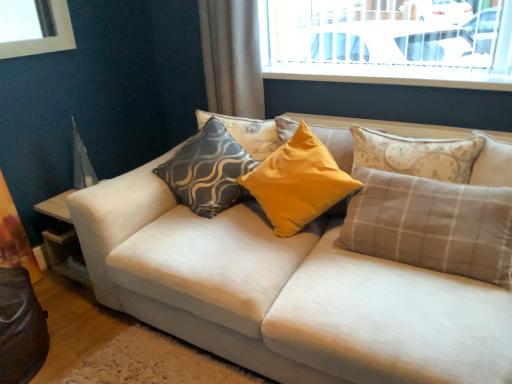
The height and width of the screenshot is (384, 512). I want to click on yellow fabric pillow at center, which is the third pillow from right to left, so click(298, 183).

This screenshot has width=512, height=384. What do you see at coordinates (208, 170) in the screenshot?
I see `matte gray-patterned pillow at center, acting as the 1th pillow starting from the left` at bounding box center [208, 170].

Measure the distance between point (11, 237) and camera.

The depth of point (11, 237) is 7.60 feet.

In order to click on gray plaid pillow at right, which is counted as the 5th pillow, starting from the left in this screenshot , I will do `click(492, 163)`.

The height and width of the screenshot is (384, 512). What do you see at coordinates (285, 293) in the screenshot?
I see `white fabric couch at center` at bounding box center [285, 293].

Image resolution: width=512 pixels, height=384 pixels. In order to click on plaid fabric pillow at center, marked as the 2th pillow in a right-to-left arrangement in this screenshot , I will do `click(432, 225)`.

This screenshot has width=512, height=384. Find the location of `matte gray-patterned pillow at center, arranged as the 4th pillow when viewed from the right`. matte gray-patterned pillow at center, arranged as the 4th pillow when viewed from the right is located at coordinates (247, 133).

Find the location of a particular element. yellow fabric pillow at center, which is the third pillow from left to right is located at coordinates (298, 183).

From the image's perspective, is brown fabric curtain at upper center, acting as the 2th curtain starting from the left, positioned above or below yellow fabric pillow at center, which is the third pillow from left to right?

brown fabric curtain at upper center, acting as the 2th curtain starting from the left, is situated higher than yellow fabric pillow at center, which is the third pillow from left to right, in the image.

Are brown fabric curtain at upper center, which is the first curtain in top-to-bottom order, and yellow fabric pillow at center, which is the third pillow from right to left, far apart?

They are positioned close to each other.

Is plaid fabric pillow at center, marked as the 2th pillow in a right-to-left arrangement, to the right of yellow fabric curtain at left, marked as the 2th curtain in a top-to-bottom arrangement, from the viewer's perspective?

Correct, you'll find plaid fabric pillow at center, marked as the 2th pillow in a right-to-left arrangement, to the right of yellow fabric curtain at left, marked as the 2th curtain in a top-to-bottom arrangement.

From the image's perspective, who appears lower, plaid fabric pillow at center, marked as the 2th pillow in a right-to-left arrangement, or yellow fabric curtain at left, which ranks as the first curtain in left-to-right order?

yellow fabric curtain at left, which ranks as the first curtain in left-to-right order, appears lower in the image.

Which of these two, plaid fabric pillow at center, marked as the 2th pillow in a right-to-left arrangement, or yellow fabric curtain at left, marked as the 2th curtain in a top-to-bottom arrangement, is thinner?

Thinner between the two is yellow fabric curtain at left, marked as the 2th curtain in a top-to-bottom arrangement.

From a real-world perspective, which is physically below, plaid fabric pillow at center, marked as the 2th pillow in a right-to-left arrangement, or yellow fabric curtain at left, the second curtain when ordered from right to left?

yellow fabric curtain at left, the second curtain when ordered from right to left, from a real-world perspective.

Is plaid fabric pillow at center, marked as the 2th pillow in a right-to-left arrangement, shorter than yellow fabric pillow at center, which is the third pillow from left to right?

No, plaid fabric pillow at center, marked as the 2th pillow in a right-to-left arrangement, is not shorter than yellow fabric pillow at center, which is the third pillow from left to right.

From a real-world perspective, between plaid fabric pillow at center, which is the 4th pillow in left-to-right order, and yellow fabric pillow at center, which is the third pillow from left to right, who is vertically higher?

From a 3D spatial view, yellow fabric pillow at center, which is the third pillow from left to right, is above.

Would you say yellow fabric pillow at center, which is the third pillow from left to right, is part of plaid fabric pillow at center, marked as the 2th pillow in a right-to-left arrangement,'s contents?

No, yellow fabric pillow at center, which is the third pillow from left to right, is located outside of plaid fabric pillow at center, marked as the 2th pillow in a right-to-left arrangement.

Is plaid fabric pillow at center, marked as the 2th pillow in a right-to-left arrangement, with yellow fabric pillow at center, which is the third pillow from right to left?

No, plaid fabric pillow at center, marked as the 2th pillow in a right-to-left arrangement, is not in contact with yellow fabric pillow at center, which is the third pillow from right to left.

Can you confirm if yellow fabric curtain at left, marked as the 2th curtain in a top-to-bottom arrangement, is bigger than plaid fabric pillow at center, marked as the 2th pillow in a right-to-left arrangement?

No, yellow fabric curtain at left, marked as the 2th curtain in a top-to-bottom arrangement, is not bigger than plaid fabric pillow at center, marked as the 2th pillow in a right-to-left arrangement.

Which object is thinner, yellow fabric curtain at left, which ranks as the first curtain in left-to-right order, or plaid fabric pillow at center, which is the 4th pillow in left-to-right order?

Thinner between the two is yellow fabric curtain at left, which ranks as the first curtain in left-to-right order.

From the image's perspective, is yellow fabric curtain at left, the 1th curtain in the bottom-to-top sequence, above or below plaid fabric pillow at center, marked as the 2th pillow in a right-to-left arrangement?

Based on their image positions, yellow fabric curtain at left, the 1th curtain in the bottom-to-top sequence, is located beneath plaid fabric pillow at center, marked as the 2th pillow in a right-to-left arrangement.

Is yellow fabric curtain at left, the 1th curtain in the bottom-to-top sequence, closer to camera compared to plaid fabric pillow at center, marked as the 2th pillow in a right-to-left arrangement?

No, yellow fabric curtain at left, the 1th curtain in the bottom-to-top sequence, is further to the viewer.

Is matte gray-patterned pillow at center, which is the 2th pillow from left to right, turned away from yellow fabric curtain at left, the 1th curtain in the bottom-to-top sequence?

No, matte gray-patterned pillow at center, which is the 2th pillow from left to right,'s orientation is not away from yellow fabric curtain at left, the 1th curtain in the bottom-to-top sequence.

In terms of height, does matte gray-patterned pillow at center, which is the 2th pillow from left to right, look taller or shorter compared to yellow fabric curtain at left, which ranks as the first curtain in left-to-right order?

Considering their sizes, matte gray-patterned pillow at center, which is the 2th pillow from left to right, has less height than yellow fabric curtain at left, which ranks as the first curtain in left-to-right order.

Where is `the 2nd pillow to the right of the yellow fabric curtain at left, the 1th curtain in the bottom-to-top sequence, counting from the anchor's position`? The width and height of the screenshot is (512, 384). the 2nd pillow to the right of the yellow fabric curtain at left, the 1th curtain in the bottom-to-top sequence, counting from the anchor's position is located at coordinates (247, 133).

Does plaid fabric pillow at center, marked as the 2th pillow in a right-to-left arrangement, turn towards matte gray-patterned pillow at center, the fifth pillow when ordered from right to left?

No, plaid fabric pillow at center, marked as the 2th pillow in a right-to-left arrangement, is not turned towards matte gray-patterned pillow at center, the fifth pillow when ordered from right to left.

From a real-world perspective, who is located lower, plaid fabric pillow at center, marked as the 2th pillow in a right-to-left arrangement, or matte gray-patterned pillow at center, acting as the 1th pillow starting from the left?

plaid fabric pillow at center, marked as the 2th pillow in a right-to-left arrangement, from a real-world perspective.

Which is correct: plaid fabric pillow at center, marked as the 2th pillow in a right-to-left arrangement, is inside matte gray-patterned pillow at center, acting as the 1th pillow starting from the left, or outside of it?

plaid fabric pillow at center, marked as the 2th pillow in a right-to-left arrangement, cannot be found inside matte gray-patterned pillow at center, acting as the 1th pillow starting from the left.

Is point (233, 33) closer or farther from the camera than point (406, 223)?

Point (233, 33) is farther from the camera than point (406, 223).

Is there a large distance between brown fabric curtain at upper center, acting as the 1th curtain starting from the right, and plaid fabric pillow at center, marked as the 2th pillow in a right-to-left arrangement?

brown fabric curtain at upper center, acting as the 1th curtain starting from the right, is positioned a significant distance from plaid fabric pillow at center, marked as the 2th pillow in a right-to-left arrangement.

Where is `the 2nd curtain behind the plaid fabric pillow at center, marked as the 2th pillow in a right-to-left arrangement, counting from the anchor's position`? This screenshot has width=512, height=384. the 2nd curtain behind the plaid fabric pillow at center, marked as the 2th pillow in a right-to-left arrangement, counting from the anchor's position is located at coordinates (232, 57).

From a real-world perspective, relative to plaid fabric pillow at center, which is the 4th pillow in left-to-right order, is brown fabric curtain at upper center, placed as the second curtain when sorted from bottom to top, vertically above or below?

From a real-world perspective, brown fabric curtain at upper center, placed as the second curtain when sorted from bottom to top, is physically above plaid fabric pillow at center, which is the 4th pillow in left-to-right order.

I want to click on the 2nd pillow positioned below the brown fabric curtain at upper center, acting as the 1th curtain starting from the right (from the image's perspective), so click(x=298, y=183).

From a real-world perspective, count 1st pillows upward from the yellow fabric curtain at left, which ranks as the first curtain in left-to-right order, and point to it. Please provide its 2D coordinates.

[(432, 225)]

Estimate the real-world distances between objects in this image. Which object is further from plaid fabric pillow at center, which is the 4th pillow in left-to-right order, gray plaid pillow at right, which is counted as the 5th pillow, starting from the left, or yellow fabric pillow at center, which is the third pillow from left to right?

yellow fabric pillow at center, which is the third pillow from left to right, is positioned further to the anchor plaid fabric pillow at center, which is the 4th pillow in left-to-right order.

Consider the image. Looking at the image, which one is located closer to brown fabric curtain at upper center, placed as the second curtain when sorted from bottom to top, matte gray-patterned pillow at center, the fifth pillow when ordered from right to left, or plaid fabric pillow at center, marked as the 2th pillow in a right-to-left arrangement?

matte gray-patterned pillow at center, the fifth pillow when ordered from right to left, is closer to brown fabric curtain at upper center, placed as the second curtain when sorted from bottom to top.

From the image, which object appears to be nearer to white fabric couch at center, yellow fabric curtain at left, marked as the 2th curtain in a top-to-bottom arrangement, or matte gray-patterned pillow at center, acting as the 1th pillow starting from the left?

matte gray-patterned pillow at center, acting as the 1th pillow starting from the left, lies closer to white fabric couch at center than the other object.

Which object lies nearer to the anchor point matte gray-patterned pillow at center, which is the 2th pillow from left to right, yellow fabric curtain at left, marked as the 2th curtain in a top-to-bottom arrangement, or plaid fabric pillow at center, which is the 4th pillow in left-to-right order?

Based on the image, plaid fabric pillow at center, which is the 4th pillow in left-to-right order, appears to be nearer to matte gray-patterned pillow at center, which is the 2th pillow from left to right.

Based on their spatial positions, is gray plaid pillow at right, which is counted as the 5th pillow, starting from the left, or yellow fabric curtain at left, marked as the 2th curtain in a top-to-bottom arrangement, closer to plaid fabric pillow at center, which is the 4th pillow in left-to-right order?

gray plaid pillow at right, which is counted as the 5th pillow, starting from the left, lies closer to plaid fabric pillow at center, which is the 4th pillow in left-to-right order, than the other object.

Looking at the image, which one is located further to brown fabric curtain at upper center, acting as the 1th curtain starting from the right, yellow fabric curtain at left, the 1th curtain in the bottom-to-top sequence, or matte gray-patterned pillow at center, which is the 2th pillow from left to right?

yellow fabric curtain at left, the 1th curtain in the bottom-to-top sequence, is further to brown fabric curtain at upper center, acting as the 1th curtain starting from the right.

Which object lies nearer to the anchor point yellow fabric pillow at center, which is the third pillow from left to right, white fabric couch at center or plaid fabric pillow at center, which is the 4th pillow in left-to-right order?

plaid fabric pillow at center, which is the 4th pillow in left-to-right order, lies closer to yellow fabric pillow at center, which is the third pillow from left to right, than the other object.

When comparing their distances from gray plaid pillow at right, which is the first pillow in right-to-left order, does white fabric couch at center or matte gray-patterned pillow at center, the fifth pillow when ordered from right to left, seem further?

matte gray-patterned pillow at center, the fifth pillow when ordered from right to left, lies further to gray plaid pillow at right, which is the first pillow in right-to-left order, than the other object.

Identify the location of studio couch between yellow fabric curtain at left, the 1th curtain in the bottom-to-top sequence, and plaid fabric pillow at center, marked as the 2th pillow in a right-to-left arrangement, in the horizontal direction. This screenshot has width=512, height=384. (285, 293).

What are the coordinates of `studio couch between yellow fabric curtain at left, which ranks as the first curtain in left-to-right order, and yellow fabric pillow at center, which is the third pillow from right to left` in the screenshot? It's located at (285, 293).

Where is `pillow between matte gray-patterned pillow at center, acting as the 1th pillow starting from the left, and yellow fabric pillow at center, which is the third pillow from right to left`? This screenshot has height=384, width=512. pillow between matte gray-patterned pillow at center, acting as the 1th pillow starting from the left, and yellow fabric pillow at center, which is the third pillow from right to left is located at coordinates click(247, 133).

Where is `pillow between yellow fabric pillow at center, which is the third pillow from right to left, and gray plaid pillow at right, which is counted as the 5th pillow, starting from the left`? pillow between yellow fabric pillow at center, which is the third pillow from right to left, and gray plaid pillow at right, which is counted as the 5th pillow, starting from the left is located at coordinates (432, 225).